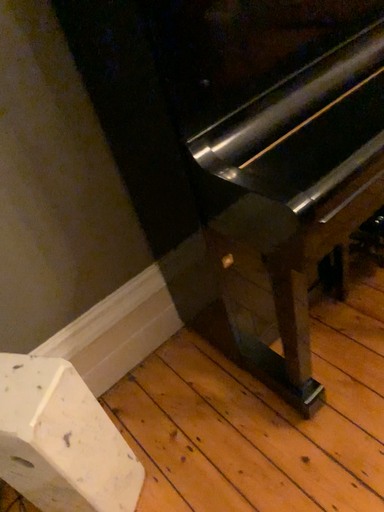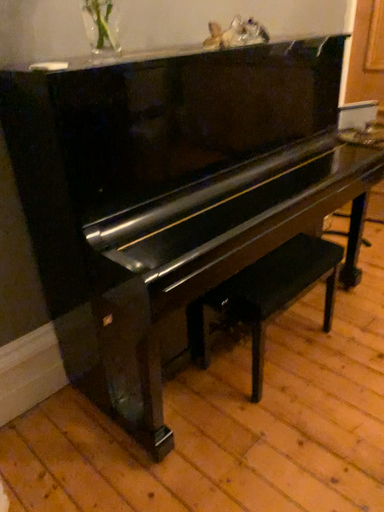
Question: Which way did the camera rotate in the video?

Choices:
 (A) rotated right
 (B) rotated left

Answer: (A)